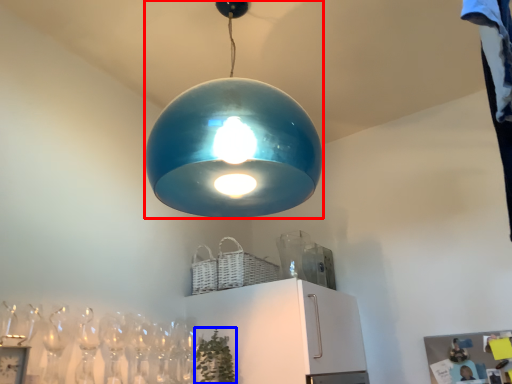
Question: Which object is closer to the camera taking this photo, lamp (highlighted by a red box) or plant (highlighted by a blue box)?

Choices:
 (A) lamp
 (B) plant

Answer: (A)